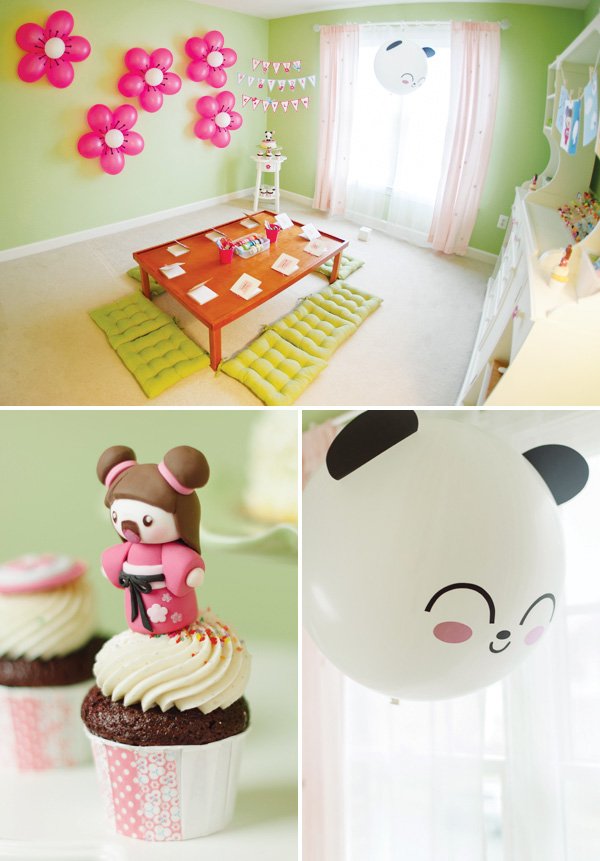
At what (x,y) coordinates should I click in order to perform the action: click on book. Please return your answer as a coordinate pair (x, y). Looking at the image, I should click on (249, 281), (288, 257), (316, 243), (206, 292), (171, 269), (176, 249), (215, 233), (249, 223), (285, 220), (307, 230).